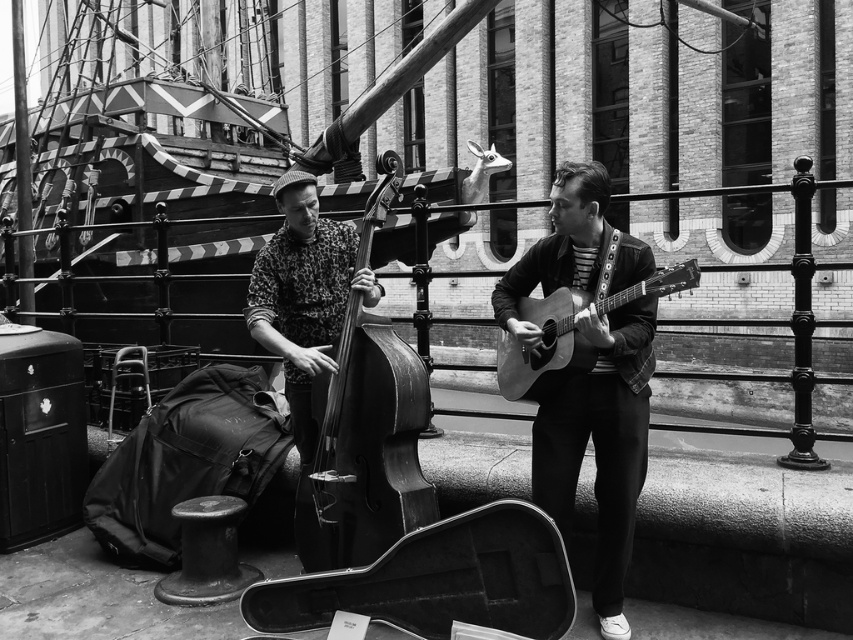
You are a music teacher setting up for a performance. You have two instruments in front of you, the wooden polished cello at center and the printed fabric bass at center. Which instrument requires more space to set up properly?

The wooden polished cello at center requires more space to set up properly because it has a larger size compared to the printed fabric bass at center.

Based on the photo, you are a photographer trying to capture both the wooden polished cello at center and the acoustic wood guitar at right in a single frame. Given that your camera has a fixed focal length, which instrument should you position closer to the camera to ensure both fit in the frame?

Since the wooden polished cello at center is larger than the acoustic wood guitar at right, you should position the wooden polished cello at center closer to the camera. This will help balance their apparent sizes in the photograph, ensuring both fit within the frame.

Based on the scene description, where is the smooth wood guitar at center located in the image?

The smooth wood guitar at center is located at point (601, 444).